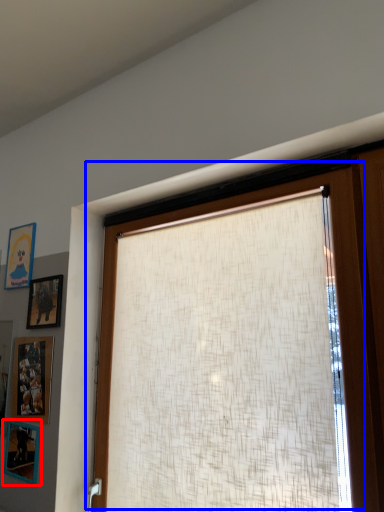
Question: Which object appears closest to the camera in this image, picture frame (highlighted by a red box) or window (highlighted by a blue box)?

Choices:
 (A) picture frame
 (B) window

Answer: (B)